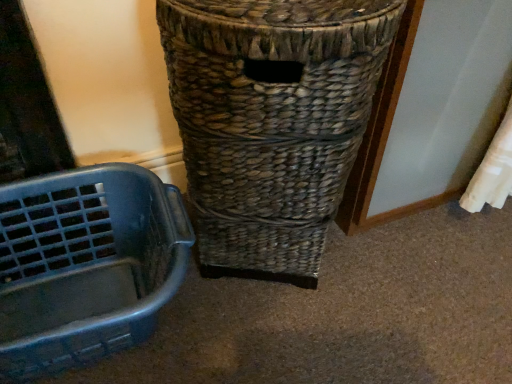
Question: From a real-world perspective, is blue plastic basket at left above or below woven brown basket at center?

Choices:
 (A) below
 (B) above

Answer: (A)

Question: Does point (154, 231) appear closer or farther from the camera than point (196, 210)?

Choices:
 (A) farther
 (B) closer

Answer: (A)

Question: Would you say blue plastic basket at left is to the left or to the right of woven brown basket at center in the picture?

Choices:
 (A) left
 (B) right

Answer: (A)

Question: Visually, is woven brown basket at center positioned to the left or to the right of blue plastic basket at left?

Choices:
 (A) left
 (B) right

Answer: (B)

Question: In the image, is woven brown basket at center positioned in front of or behind blue plastic basket at left?

Choices:
 (A) behind
 (B) front

Answer: (B)

Question: Is woven brown basket at center inside the boundaries of blue plastic basket at left, or outside?

Choices:
 (A) outside
 (B) inside

Answer: (A)

Question: Is point (366, 66) positioned closer to the camera than point (28, 190)?

Choices:
 (A) closer
 (B) farther

Answer: (A)